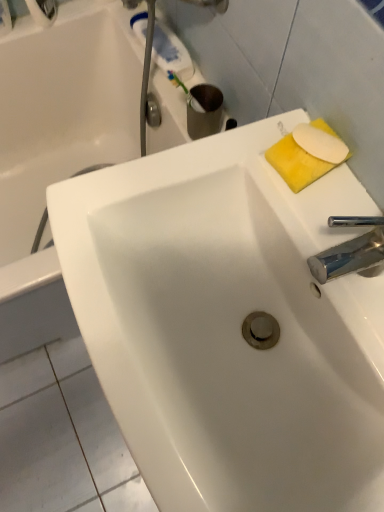
Question: From a real-world perspective, is white glossy bathtub at upper left above or below yellow sponge at upper right, placed as the 1th soap when sorted from back to front?

Choices:
 (A) above
 (B) below

Answer: (B)

Question: Considering the positions of white glossy bathtub at upper left and yellow sponge at upper right, which ranks as the second soap in front-to-back order, in the image, is white glossy bathtub at upper left wider or thinner than yellow sponge at upper right, which ranks as the second soap in front-to-back order,?

Choices:
 (A) thin
 (B) wide

Answer: (B)

Question: Which of these objects is positioned farthest from the white matte soap at upper right, positioned as the 2th soap in back-to-front order?

Choices:
 (A) metallic knob at upper center
 (B) white glossy bathtub at upper left
 (C) white glossy sink at center
 (D) yellow sponge at upper right, placed as the 1th soap when sorted from back to front

Answer: (B)

Question: Estimate the real-world distances between objects in this image. Which object is farther from the white glossy bathtub at upper left?

Choices:
 (A) yellow sponge at upper right, placed as the 1th soap when sorted from back to front
 (B) metallic knob at upper center
 (C) white glossy sink at center
 (D) white matte soap at upper right, positioned as the first soap in front-to-back order

Answer: (D)